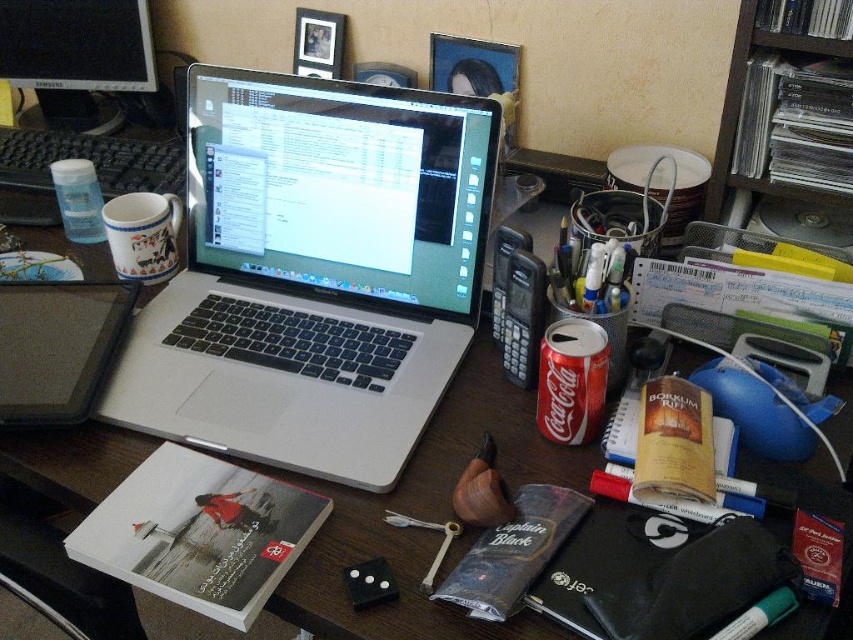
Question: Is silver metallic laptop at center wider than white ceramic mug at left?

Choices:
 (A) yes
 (B) no

Answer: (A)

Question: Is black plastic case at left thinner than white ceramic mug at left?

Choices:
 (A) no
 (B) yes

Answer: (A)

Question: Based on their relative distances, which object is farther from the white ceramic mug at left?

Choices:
 (A) silver metallic laptop at center
 (B) black glossy computer monitor at upper left
 (C) black plastic case at left

Answer: (B)

Question: Which object is farther from the camera taking this photo?

Choices:
 (A) white ceramic mug at left
 (B) black glossy computer monitor at upper left
 (C) silver metallic laptop at center
 (D) black plastic case at left

Answer: (B)

Question: Can you confirm if silver metallic laptop at center is bigger than black plastic case at left?

Choices:
 (A) yes
 (B) no

Answer: (A)

Question: Which point is closer to the camera?

Choices:
 (A) (264, 109)
 (B) (122, 19)
 (C) (57, 296)
 (D) (138, 257)

Answer: (A)